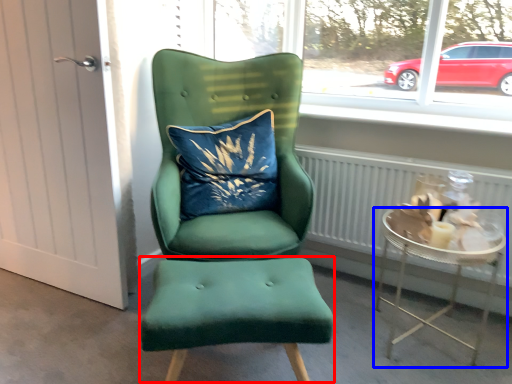
Question: Which of the following is the farthest to the observer, stool (highlighted by a red box) or table (highlighted by a blue box)?

Choices:
 (A) stool
 (B) table

Answer: (B)